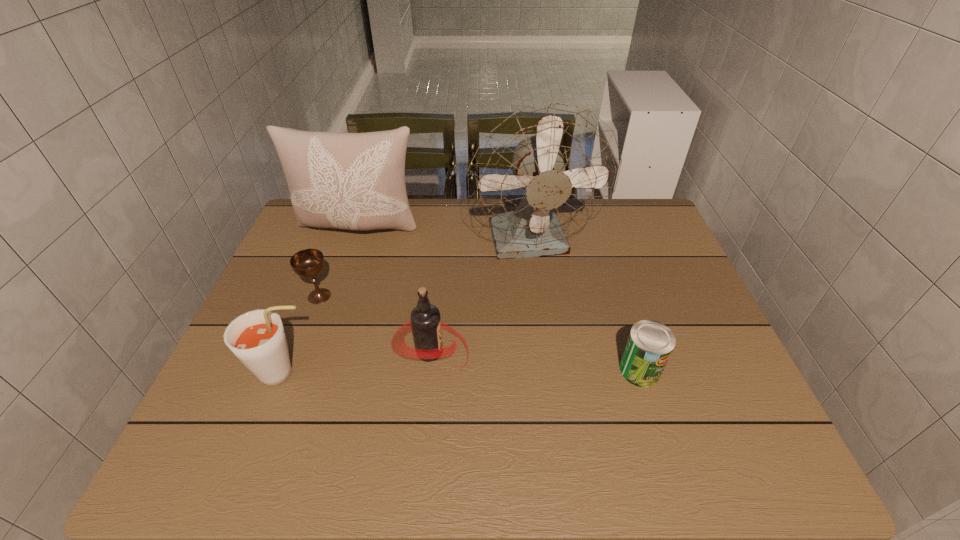
Image resolution: width=960 pixels, height=540 pixels. I want to click on vacant region at the near left corner of the desktop, so click(x=245, y=458).

The image size is (960, 540). I want to click on vacant space at the far right corner of the desktop, so click(654, 212).

Identify the location of vacant space at the near right corner of the desktop. The width and height of the screenshot is (960, 540). (779, 464).

Locate an element on the screen. vacant space that's between the tallest object and the can is located at coordinates (587, 307).

This screenshot has width=960, height=540. Find the location of `vacant region between the tallest object and the third farthest object`. vacant region between the tallest object and the third farthest object is located at coordinates tap(426, 270).

In order to click on free space between the right root beer and the left root beer in this screenshot , I will do `click(357, 363)`.

Image resolution: width=960 pixels, height=540 pixels. I want to click on empty space that is in between the third farthest object and the left root beer, so click(301, 335).

Identify the location of blank region between the left root beer and the chalice. The width and height of the screenshot is (960, 540). (301, 335).

You are a GUI agent. You are given a task and a screenshot of the screen. Output one action in this format:
    pyautogui.click(x=<x>, y=<y>)
    Task: Click on the blank region between the right root beer and the can
    The image size is (960, 540).
    Given the screenshot: What is the action you would take?
    pyautogui.click(x=536, y=360)

This screenshot has width=960, height=540. I want to click on free area in between the cushion and the tallest object, so click(446, 236).